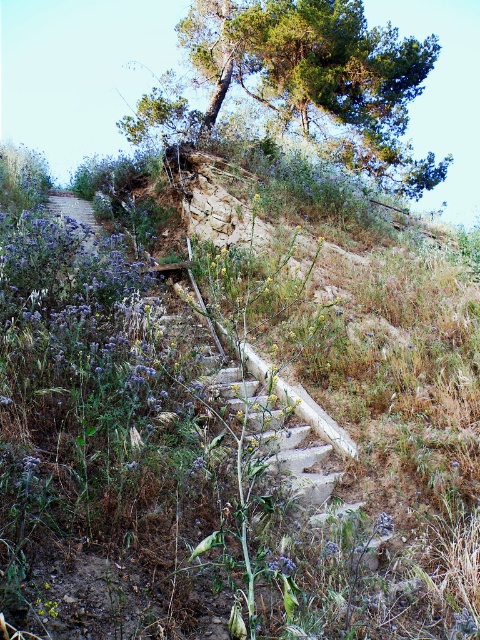
Is green leafy tree at upper center positioned in front of purple floral trail at upper left?

No, green leafy tree at upper center is behind purple floral trail at upper left.

Who is lower down, green leafy tree at upper center or purple floral trail at upper left?

purple floral trail at upper left is lower down.

Is point (357, 49) positioned before point (54, 208)?

That is False.

Where is `green leafy tree at upper center`? The image size is (480, 640). green leafy tree at upper center is located at coordinates (305, 80).